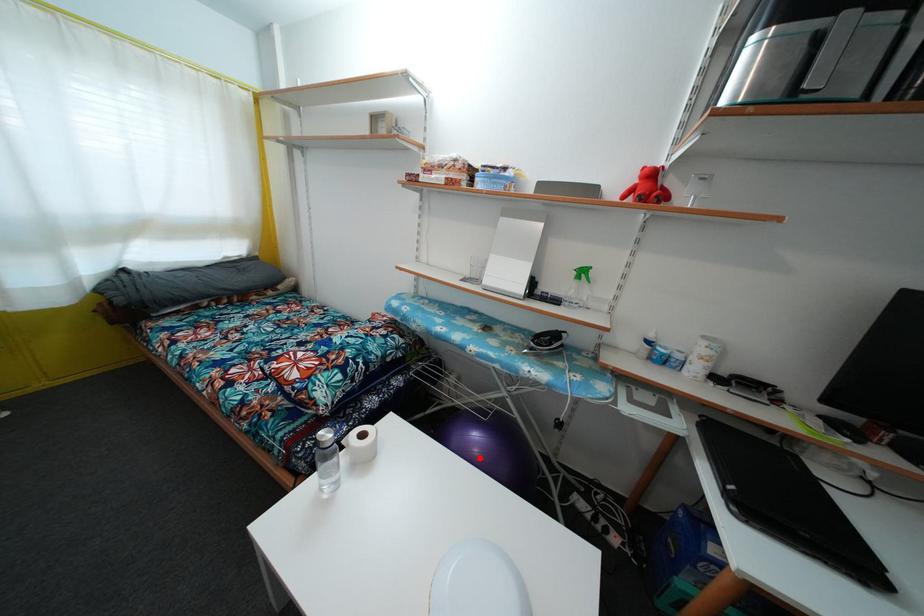
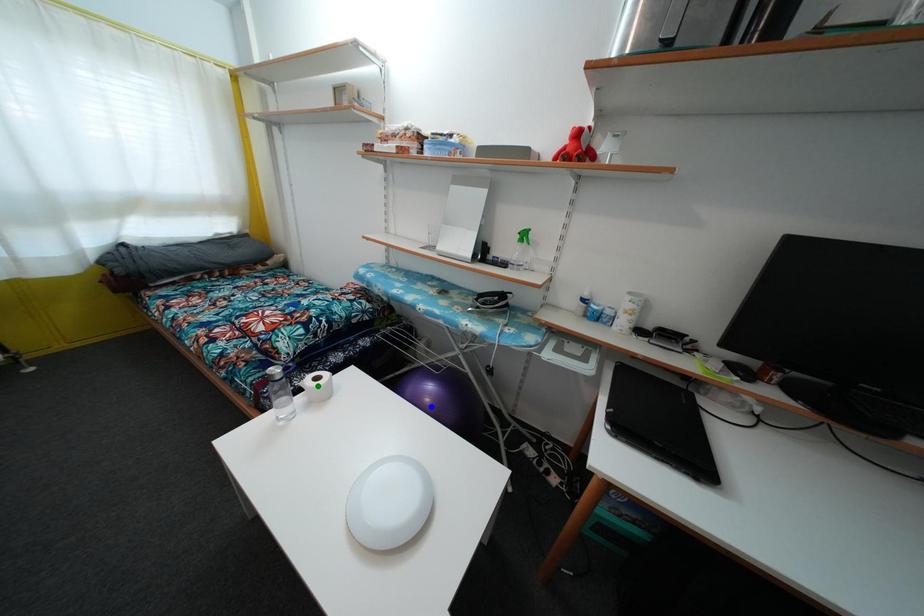
Question: I am providing you with two images of the same scene from different viewpoints. A red point is marked on the first image. You are given multiple points on the second image. Which mark in image 2 goes with the point in image 1?

Choices:
 (A) blue point
 (B) yellow point
 (C) green point

Answer: (A)